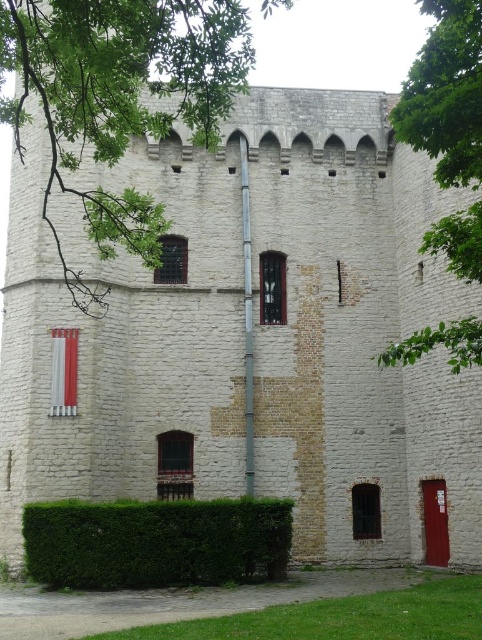
Can you confirm if green leafy tree at upper left is shorter than green leafy hedge at lower left?

In fact, green leafy tree at upper left may be taller than green leafy hedge at lower left.

Can you confirm if green leafy tree at upper left is positioned below green leafy hedge at lower left?

Incorrect, green leafy tree at upper left is not positioned below green leafy hedge at lower left.

What do you see at coordinates (119, 97) in the screenshot? This screenshot has width=482, height=640. I see `green leafy tree at upper left` at bounding box center [119, 97].

Image resolution: width=482 pixels, height=640 pixels. I want to click on green leafy tree at upper left, so click(119, 97).

Can you confirm if green leafy tree at upper left is taller than green leafy tree at upper right?

Yes.

Is point (67, 97) less distant than point (465, 124)?

No, it is behind (465, 124).

Is point (142, 26) behind point (426, 118)?

No, it is in front of (426, 118).

Locate an element on the screen. The image size is (482, 640). green leafy tree at upper left is located at coordinates (119, 97).

Between point (222, 513) and point (407, 122), which one is positioned behind?

The point (222, 513) is more distant.

Is point (120, 516) positioned in front of point (449, 113)?

No, (120, 516) is further to viewer.

Locate an element on the screen. The height and width of the screenshot is (640, 482). green leafy hedge at lower left is located at coordinates (157, 541).